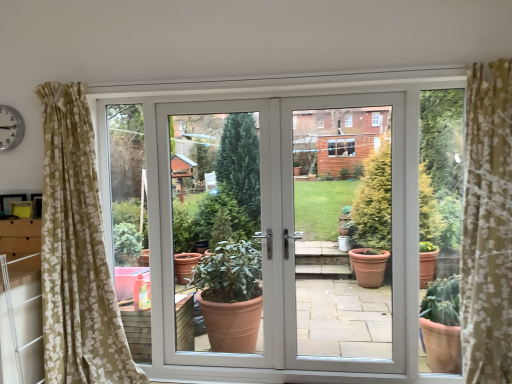
Question: Can you confirm if white plastic screen door at center is smaller than white glossy door at center?

Choices:
 (A) yes
 (B) no

Answer: (A)

Question: Is white plastic screen door at center aimed at white glossy door at center?

Choices:
 (A) yes
 (B) no

Answer: (A)

Question: Is white plastic screen door at center at the left side of white glossy door at center?

Choices:
 (A) no
 (B) yes

Answer: (A)

Question: Would you say white plastic screen door at center is outside white glossy door at center?

Choices:
 (A) no
 (B) yes

Answer: (A)

Question: Does white plastic screen door at center have a larger size compared to white glossy door at center?

Choices:
 (A) no
 (B) yes

Answer: (A)

Question: Considering the relative positions of white glossy door at center and white plastic screen door at center in the image provided, is white glossy door at center to the left or to the right of white plastic screen door at center?

Choices:
 (A) right
 (B) left

Answer: (B)

Question: From the image's perspective, is white glossy door at center above or below white plastic screen door at center?

Choices:
 (A) above
 (B) below

Answer: (B)

Question: In terms of height, does white glossy door at center look taller or shorter compared to white plastic screen door at center?

Choices:
 (A) short
 (B) tall

Answer: (A)

Question: Is point (290, 345) positioned closer to the camera than point (286, 342)?

Choices:
 (A) closer
 (B) farther

Answer: (B)

Question: Relative to white plastic clock at upper left, is white plastic screen door at center in front or behind?

Choices:
 (A) front
 (B) behind

Answer: (A)

Question: Is white plastic screen door at center taller or shorter than white plastic clock at upper left?

Choices:
 (A) short
 (B) tall

Answer: (B)

Question: Would you say white plastic screen door at center is inside or outside white plastic clock at upper left?

Choices:
 (A) inside
 (B) outside

Answer: (B)

Question: Considering the positions of point (301, 336) and point (16, 117), is point (301, 336) closer or farther from the camera than point (16, 117)?

Choices:
 (A) closer
 (B) farther

Answer: (B)

Question: Is white plastic clock at upper left wider or thinner than white plastic screen door at center?

Choices:
 (A) thin
 (B) wide

Answer: (A)

Question: From a real-world perspective, is white plastic clock at upper left above or below white plastic screen door at center?

Choices:
 (A) below
 (B) above

Answer: (B)